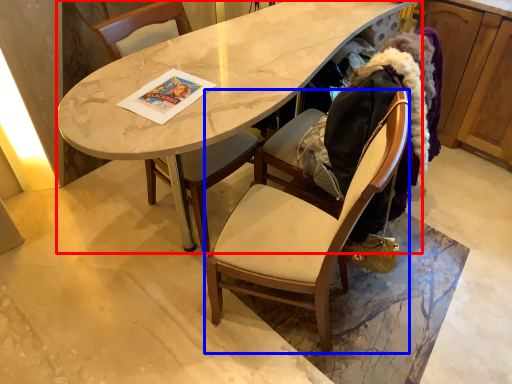
Question: Which of the following is the closest to the observer, desk (highlighted by a red box) or chair (highlighted by a blue box)?

Choices:
 (A) desk
 (B) chair

Answer: (B)